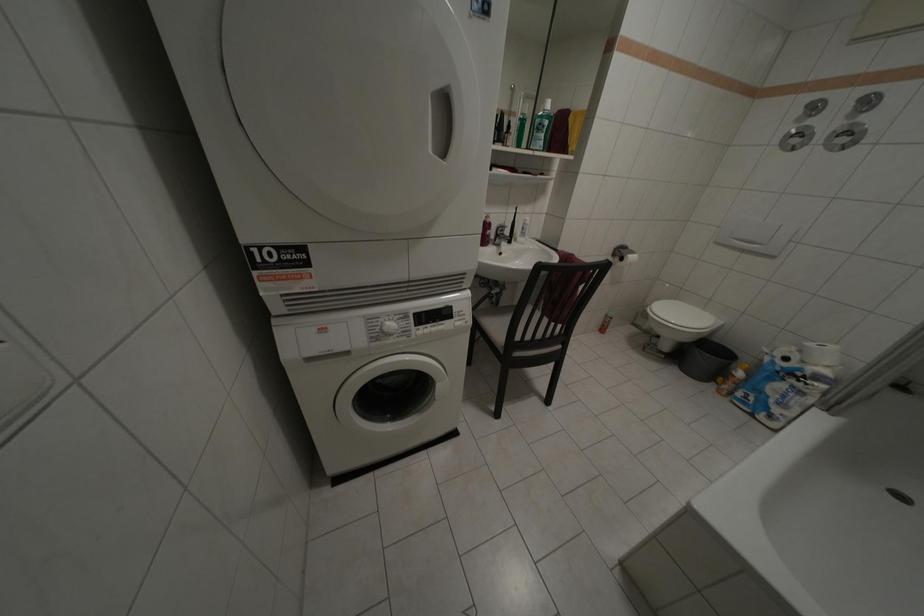
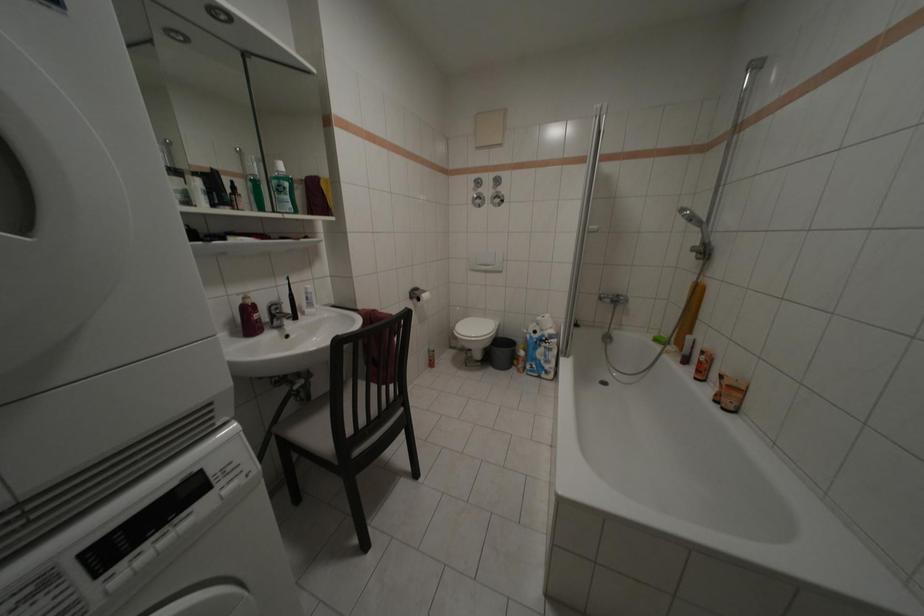
Question: How did the camera likely rotate?

Choices:
 (A) Left
 (B) Right
 (C) Up
 (D) Down

Answer: (B)